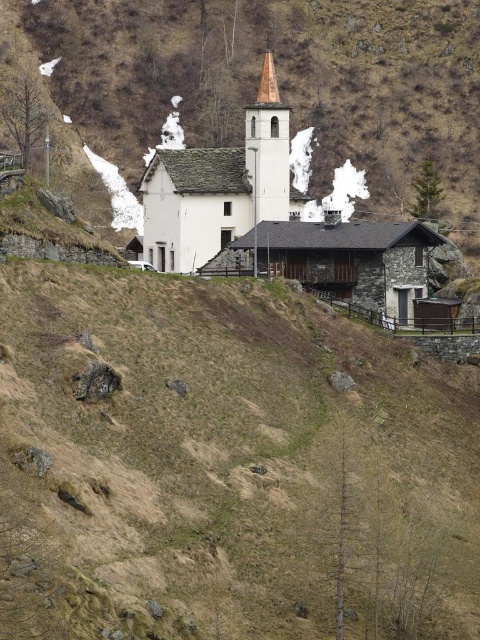
Question: Is brown grassy hillside at center to the right of white stone church at center from the viewer's perspective?

Choices:
 (A) yes
 (B) no

Answer: (B)

Question: Is brown grassy hillside at center to the right of white stone church at center from the viewer's perspective?

Choices:
 (A) yes
 (B) no

Answer: (B)

Question: Can you confirm if white stone church at center is positioned to the left of white matte church at center?

Choices:
 (A) yes
 (B) no

Answer: (B)

Question: Which of the following is the farthest from the observer?

Choices:
 (A) brown grassy hillside at center
 (B) white stone church at center
 (C) white matte church at center
 (D) brown wood spire at center

Answer: (D)

Question: Which object is closer to the camera taking this photo?

Choices:
 (A) brown grassy hillside at center
 (B) white stone church at center
 (C) white matte church at center
 (D) brown wood spire at center

Answer: (A)

Question: Which point is farther to the camera?

Choices:
 (A) white stone church at center
 (B) brown wood spire at center
 (C) white matte church at center

Answer: (B)